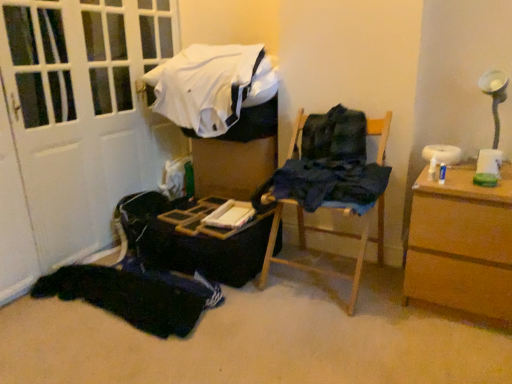
You are a GUI agent. You are given a task and a screenshot of the screen. Output one action in this format:
    pyautogui.click(x=<x>, y=<y>)
    Task: Click on the free space in front of black fabric at lower left, placed as the 1th clothing when sorted from bottom to top
    
    Given the screenshot: What is the action you would take?
    pyautogui.click(x=92, y=352)